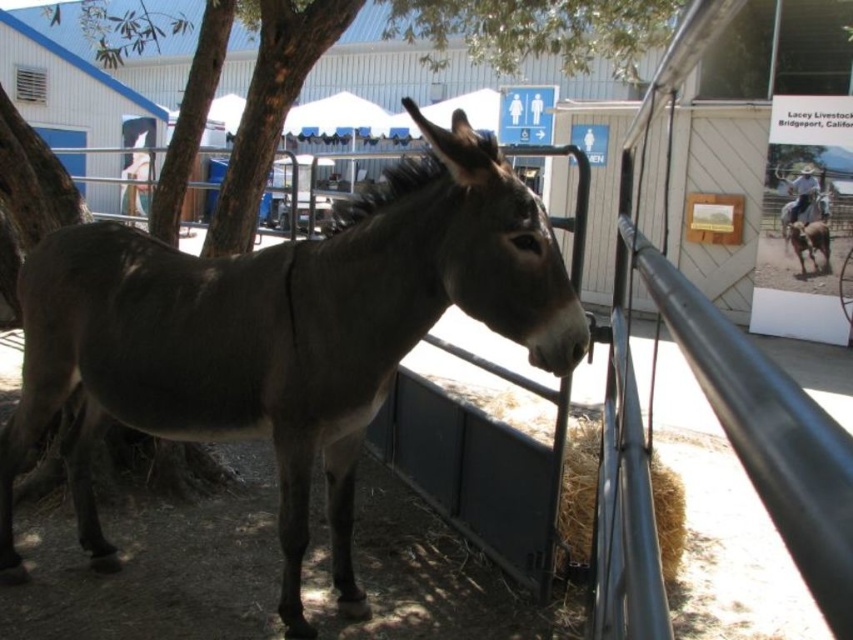
You are standing in front of the donkey at the farm. You notice two points marked in the image. The first point is at coordinate (350,342) and the second point is at (573,472). Which of these two points is closer to you?

The point at coordinate (350,342) is closer to you than the point at (573,472).

Looking at this image, you are a farmer who needs to move the gray matte mule at center to a safer area away from the green leafy tree at upper left. Based on their positions, which direction should you guide the mule to move away from the tree?

The gray matte mule at center is located below the green leafy tree at upper left. To move it away from the tree, guide the mule downward away from the tree.

You are standing at the center of the image and want to locate the green leafy tree at upper left. According to the coordinates provided, in which direction should you look to find it?

The green leafy tree at upper left is located at coordinates point (535,29), so you should look towards the upper left direction from the center to find it.